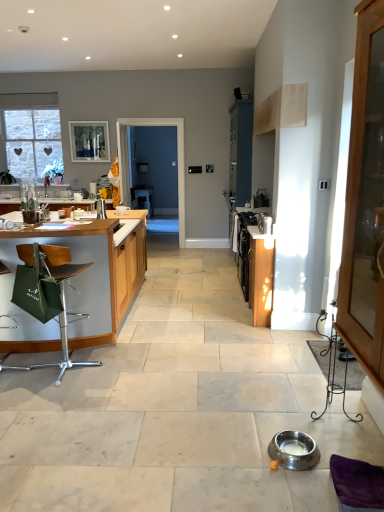
At what (x,y) coordinates should I click in order to perform the action: click on free location to the left of purple fabric swivel chair at lower right. Please return your answer as a coordinate pair (x, y). The width and height of the screenshot is (384, 512). Looking at the image, I should click on (302, 489).